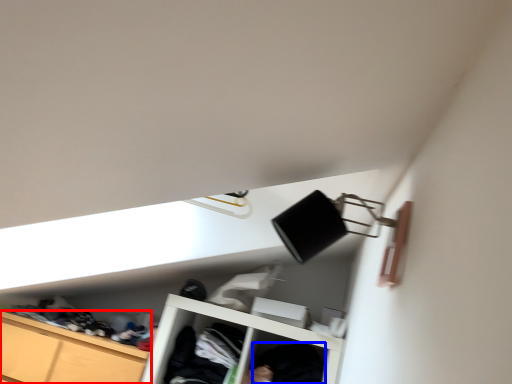
Question: Among these objects, which one is nearest to the camera, cabinetry (highlighted by a red box) or clothing (highlighted by a blue box)?

Choices:
 (A) cabinetry
 (B) clothing

Answer: (B)